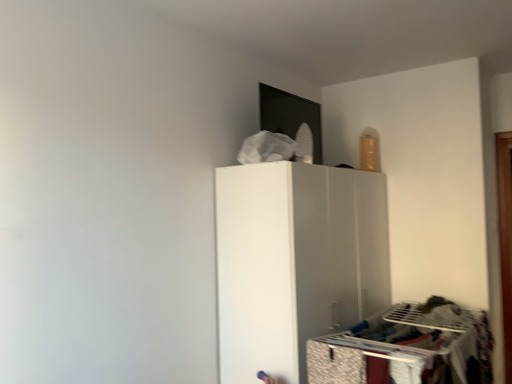
Question: Looking at the image, does patterned fabric drawer at lower right seem bigger or smaller compared to white matte cabinet at center?

Choices:
 (A) big
 (B) small

Answer: (B)

Question: Is patterned fabric drawer at lower right taller or shorter than white matte cabinet at center?

Choices:
 (A) tall
 (B) short

Answer: (B)

Question: Relative to white matte cabinet at center, is patterned fabric drawer at lower right in front or behind?

Choices:
 (A) behind
 (B) front

Answer: (B)

Question: Is white matte cabinet at center in front of or behind patterned fabric drawer at lower right in the image?

Choices:
 (A) front
 (B) behind

Answer: (B)

Question: Visually, is white matte cabinet at center positioned to the left or to the right of patterned fabric drawer at lower right?

Choices:
 (A) right
 (B) left

Answer: (A)

Question: From a real-world perspective, is white matte cabinet at center physically located above or below patterned fabric drawer at lower right?

Choices:
 (A) below
 (B) above

Answer: (B)

Question: Choose the correct answer: Is white matte cabinet at center inside patterned fabric drawer at lower right or outside it?

Choices:
 (A) outside
 (B) inside

Answer: (A)